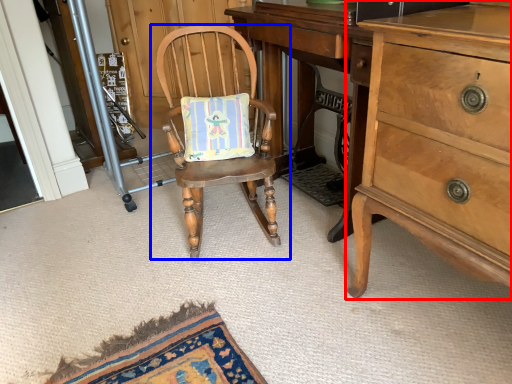
Question: Which of the following is the closest to the observer, cabinetry (highlighted by a red box) or chair (highlighted by a blue box)?

Choices:
 (A) cabinetry
 (B) chair

Answer: (A)